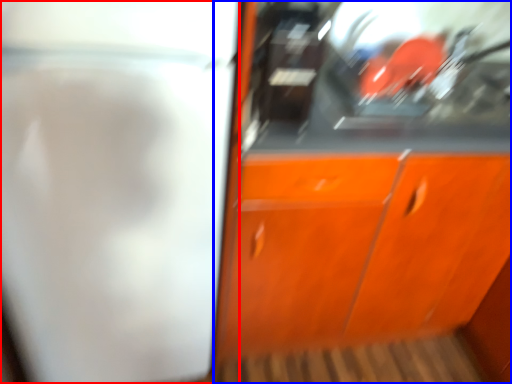
Question: Which object appears farthest to the camera in this image, screen door (highlighted by a red box) or cabinetry (highlighted by a blue box)?

Choices:
 (A) screen door
 (B) cabinetry

Answer: (B)